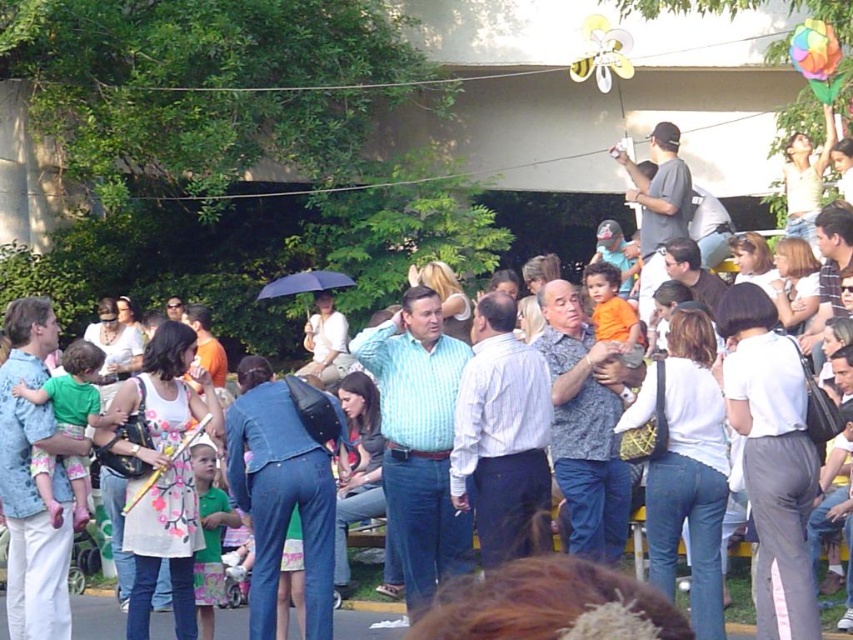
Measure the distance between rainbow fabric balloon at upper right and camera.

rainbow fabric balloon at upper right is 13.53 meters from camera.

This screenshot has width=853, height=640. I want to click on rainbow fabric balloon at upper right, so click(x=814, y=49).

At what (x,y) coordinates should I click in order to perform the action: click on rainbow fabric balloon at upper right. Please return your answer as a coordinate pair (x, y). The image size is (853, 640). Looking at the image, I should click on (814, 49).